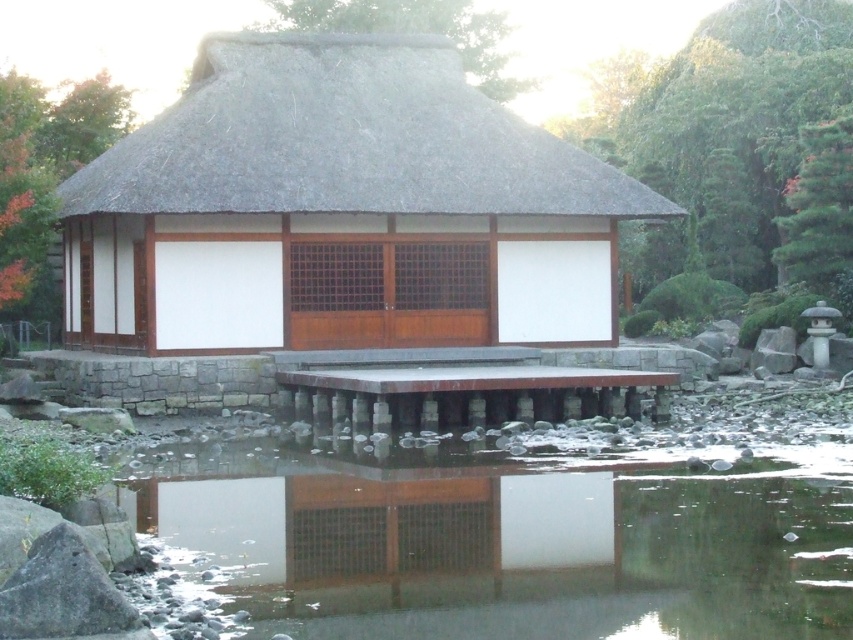
You are standing in front of the pavilion and want to take a photo. There are two points marked in the image, point 1 at coordinates point [839,548] and point 2 at coordinates point [363,38]. Which point should you focus on to ensure the closer one is in sharp focus?

Point 1 at coordinates point [839,548] is closer to the camera than point 2 at coordinates point [363,38]. Therefore, focusing on point 1 will ensure the closer point is in sharp focus.

You are a visitor standing in front of the traditional Japanese pavilion. You notice the transparent glass water at lower center and the thatched roof at center. Which object appears larger in the image?

The thatched roof at center appears larger than the transparent glass water at lower center.

You are standing at the entrance of the pavilion and want to see the transparent glass water at lower center. According to the coordinates provided, where should you look to see it?

You should look towards the lower center area at coordinates point [512,547] to see the transparent glass water at lower center.